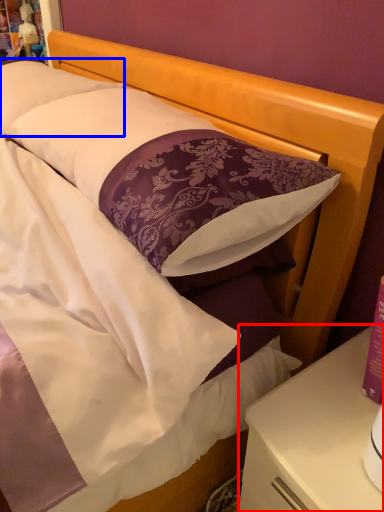
Question: Which object is further to the camera taking this photo, nightstand (highlighted by a red box) or pillow (highlighted by a blue box)?

Choices:
 (A) nightstand
 (B) pillow

Answer: (B)